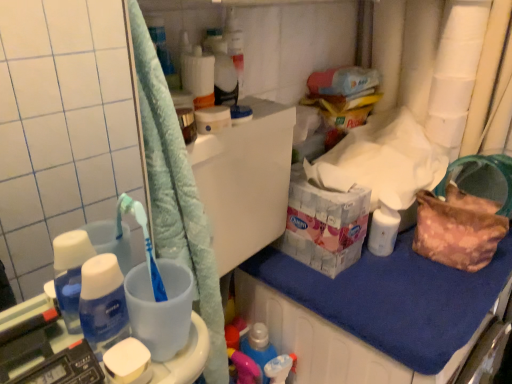
Locate an element on the screen. white matte toilet paper at upper right is located at coordinates (456, 70).

At what (x,y) coordinates should I click in order to perform the action: click on black plastic scale at lower left. Please return your answer as a coordinate pair (x, y). Looking at the image, I should click on (65, 368).

Is white matte toilet paper at upper right turned away from white matte soap at lower left?

white matte toilet paper at upper right is not turned away from white matte soap at lower left.

Does white matte toilet paper at upper right appear on the left side of white matte soap at lower left?

No, white matte toilet paper at upper right is not to the left of white matte soap at lower left.

Which object is closer to the camera taking this photo, white matte toilet paper at upper right or white matte soap at lower left?

white matte soap at lower left.

Is white matte toilet paper at upper right positioned far away from white matte soap at lower left?

Absolutely, white matte toilet paper at upper right is distant from white matte soap at lower left.

Is blue fabric at lower right facing towards blue opaque bottle at lower left?

No.

What's the angular difference between blue fabric at lower right and blue opaque bottle at lower left's facing directions?

0.86 degrees.

Is blue fabric at lower right not within blue opaque bottle at lower left?

Yes, blue fabric at lower right is outside of blue opaque bottle at lower left.

Is point (262, 321) positioned behind point (116, 305)?

That is True.

Is white matte toilet paper at upper right at the right side of white glossy bottle at right?

Yes, white matte toilet paper at upper right is to the right of white glossy bottle at right.

Between white matte toilet paper at upper right and white glossy bottle at right, which one has smaller width?

Thinner between the two is white glossy bottle at right.

Is white matte toilet paper at upper right directly adjacent to white glossy bottle at right?

No, white matte toilet paper at upper right is not touching white glossy bottle at right.

Is point (434, 92) behind point (388, 254)?

Yes.

Can you confirm if white matte soap at lower left is shorter than white glossy bottle at right?

Yes, white matte soap at lower left is shorter than white glossy bottle at right.

Do you think white matte soap at lower left is within white glossy bottle at right, or outside of it?

white matte soap at lower left is not inside white glossy bottle at right, it's outside.

Can you tell me how much white matte soap at lower left and white glossy bottle at right differ in facing direction?

The angular difference between white matte soap at lower left and white glossy bottle at right is 3.01 degrees.

From a real-world perspective, is white matte soap at lower left on top of white glossy bottle at right?

Indeed, from a real-world perspective, white matte soap at lower left stands above white glossy bottle at right.

From the image's perspective, relative to white matte toilet paper at upper right, is white glossy bottle at right above or below?

white glossy bottle at right is below white matte toilet paper at upper right.

Which of these two, white glossy bottle at right or white matte toilet paper at upper right, is thinner?

Thinner between the two is white glossy bottle at right.

Is white glossy bottle at right turned away from white matte toilet paper at upper right?

No, white glossy bottle at right's orientation is not away from white matte toilet paper at upper right.

Between blue opaque bottle at lower left and black plastic scale at lower left, which one has more height?

With more height is blue opaque bottle at lower left.

Considering their positions, is blue opaque bottle at lower left located in front of or behind black plastic scale at lower left?

blue opaque bottle at lower left is positioned farther from the viewer than black plastic scale at lower left.

Considering the points (100, 263) and (77, 372), which point is behind, point (100, 263) or point (77, 372)?

The point (100, 263) is more distant.

I want to click on soap on the left side of white glossy bottle at right, so click(x=128, y=362).

Does point (374, 217) come behind point (134, 350)?

Yes, point (374, 217) is behind point (134, 350).

Is white glossy bottle at right outside of white matte soap at lower left?

That's correct, white glossy bottle at right is outside of white matte soap at lower left.

Can you tell me how much white glossy bottle at right and white matte soap at lower left differ in facing direction?

3.01 degrees separate the facing orientations of white glossy bottle at right and white matte soap at lower left.

There is a white matte soap at lower left. In order to click on toilet paper above it (from a real-world perspective) in this screenshot , I will do `click(456, 70)`.

Where is `bottle on the left side of blue fabric at lower right`? The width and height of the screenshot is (512, 384). bottle on the left side of blue fabric at lower right is located at coordinates (103, 303).

Based on their spatial positions, is white matte toilet paper at upper right or black plastic scale at lower left further from white glossy bottle at right?

black plastic scale at lower left is positioned further to the anchor white glossy bottle at right.

Based on their spatial positions, is white matte toilet paper at upper right or white matte soap at lower left further from blue opaque bottle at lower left?

white matte toilet paper at upper right is further to blue opaque bottle at lower left.

Looking at the image, which one is located further to white matte soap at lower left, white matte toilet paper at upper right or white glossy bottle at right?

white matte toilet paper at upper right lies further to white matte soap at lower left than the other object.

Estimate the real-world distances between objects in this image. Which object is further from white glossy bottle at right, blue fabric at lower right or black plastic scale at lower left?

black plastic scale at lower left.

When comparing their distances from blue fabric at lower right, does white glossy bottle at right or white matte toilet paper at upper right seem closer?

white glossy bottle at right is closer to blue fabric at lower right.

Estimate the real-world distances between objects in this image. Which object is further from blue fabric at lower right, white matte soap at lower left or white matte toilet paper at upper right?

white matte soap at lower left is positioned further to the anchor blue fabric at lower right.

From the image, which object appears to be farther from white glossy bottle at right, white matte toilet paper at upper right or white matte soap at lower left?

The object further to white glossy bottle at right is white matte soap at lower left.

Which object lies nearer to the anchor point blue fabric at lower right, white glossy bottle at right or black plastic scale at lower left?

white glossy bottle at right is positioned closer to the anchor blue fabric at lower right.

You are a GUI agent. You are given a task and a screenshot of the screen. Output one action in this format:
    pyautogui.click(x=<x>, y=<y>)
    Task: Click on the counter top between black plastic scale at lower left and white matte toilet paper at upper right from left to right
    Image resolution: width=512 pixels, height=384 pixels.
    Given the screenshot: What is the action you would take?
    pyautogui.click(x=394, y=299)

This screenshot has width=512, height=384. In order to click on soap between black plastic scale at lower left and white glossy bottle at right along the z-axis in this screenshot , I will do `click(128, 362)`.

Find the location of a particular element. This screenshot has width=512, height=384. soap between blue opaque bottle at lower left and blue fabric at lower right in the horizontal direction is located at coordinates (128, 362).

The width and height of the screenshot is (512, 384). Find the location of `cleaning product between black plastic scale at lower left and white matte toilet paper at upper right in the horizontal direction`. cleaning product between black plastic scale at lower left and white matte toilet paper at upper right in the horizontal direction is located at coordinates click(x=383, y=230).